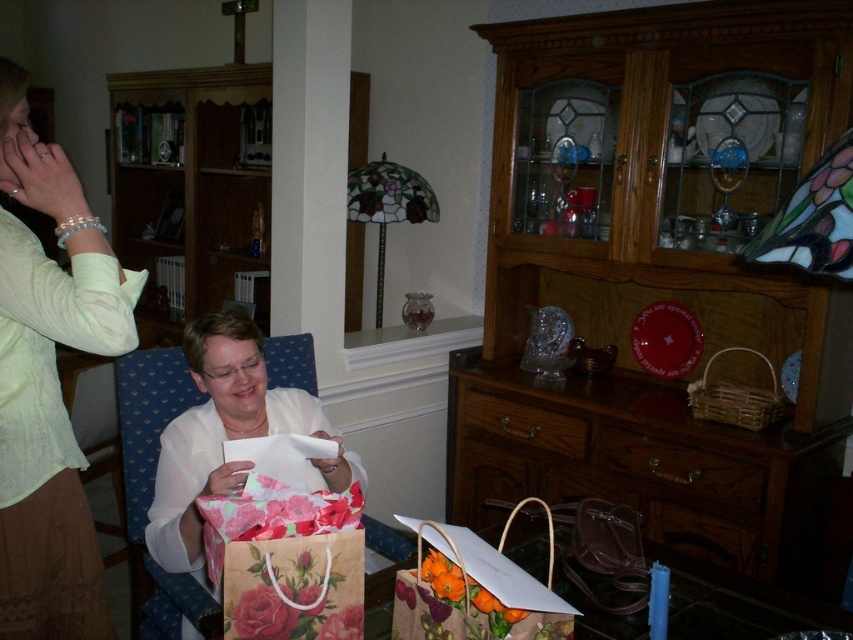
What do you see at coordinates (49, 384) in the screenshot? The height and width of the screenshot is (640, 853). I see `light green fabric shirt at upper left` at bounding box center [49, 384].

Can you confirm if light green fabric shirt at upper left is positioned to the right of floral paper bag at center?

In fact, light green fabric shirt at upper left is to the left of floral paper bag at center.

Is point (64, 435) farther from viewer compared to point (297, 394)?

No, (64, 435) is in front of (297, 394).

Locate an element on the screen. The width and height of the screenshot is (853, 640). light green fabric shirt at upper left is located at coordinates (49, 384).